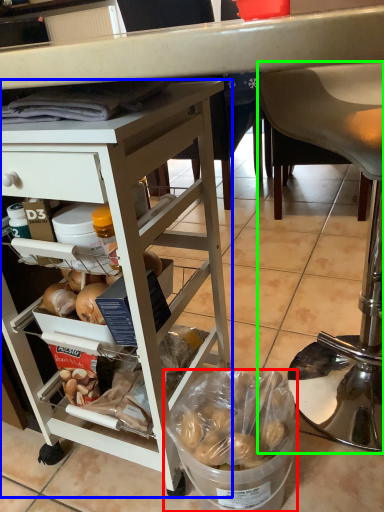
Question: Which object is positioned farthest from bowl (highlighted by a red box)? Select from desk (highlighted by a blue box) and chair (highlighted by a green box).

Choices:
 (A) desk
 (B) chair

Answer: (B)